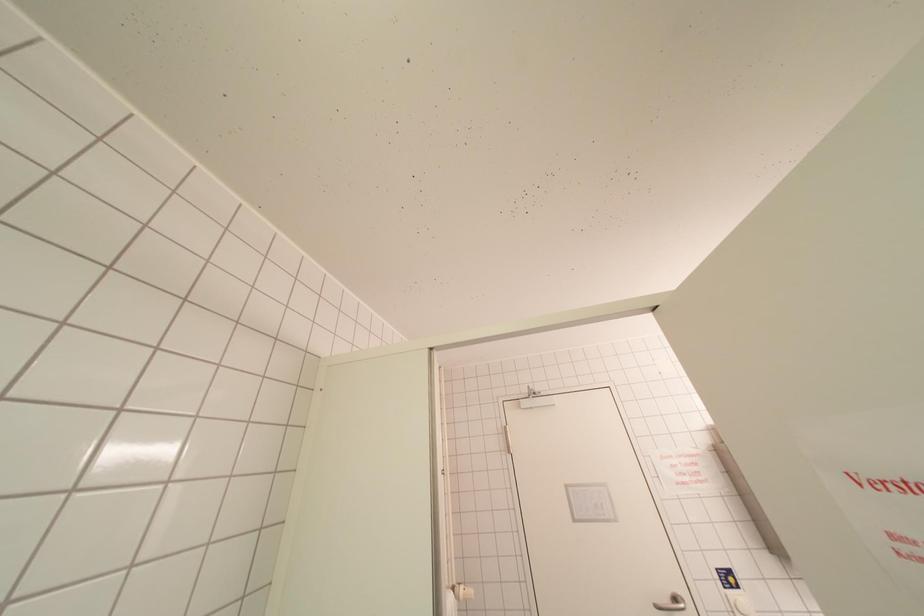
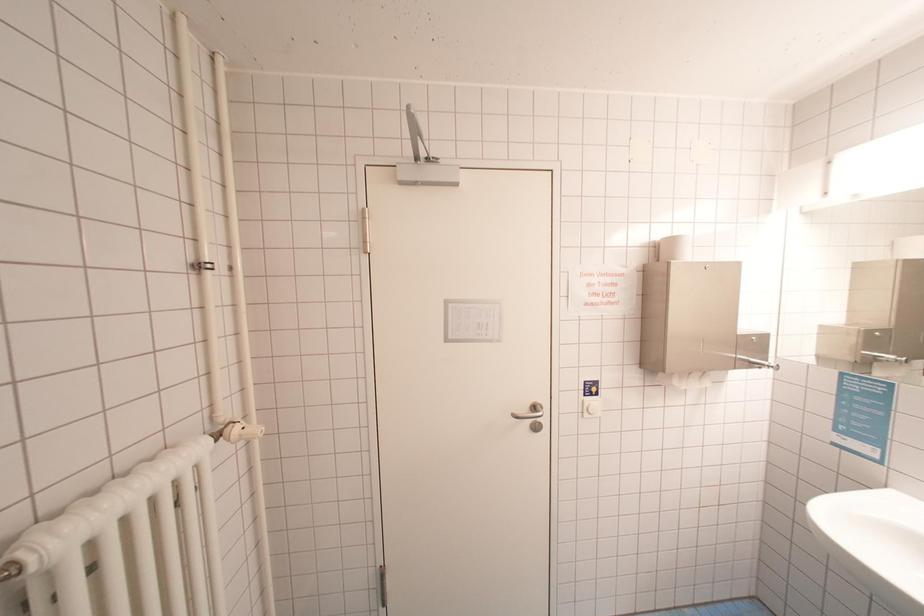
First-person continuous shooting, in which direction is the camera rotating?

The camera's rotation is toward right-down.